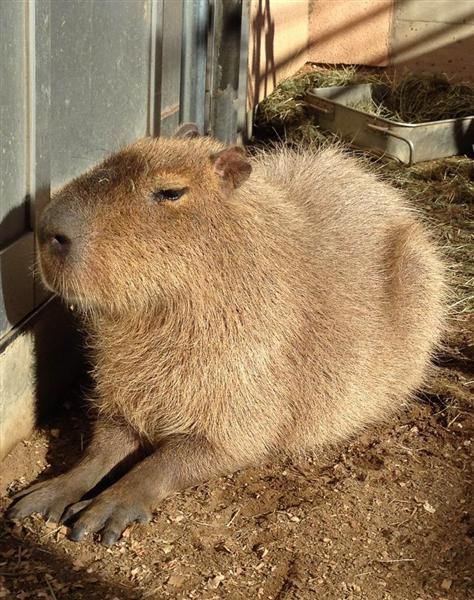
Find the location of a particular element. left front leg is located at coordinates (156, 492).